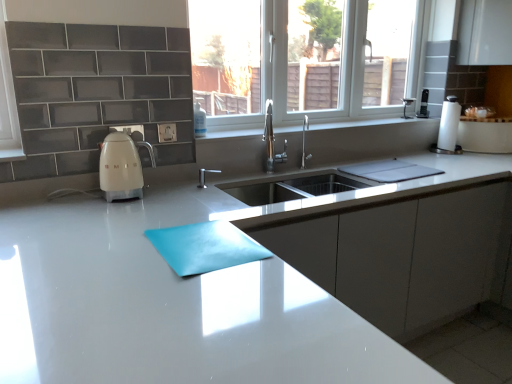
You are a GUI agent. You are given a task and a screenshot of the screen. Output one action in this format:
    pyautogui.click(x=<x>, y=<y>)
    Task: Click on the vacant region above white glossy countertop at center (from a real-world perspective)
    This screenshot has height=384, width=512.
    Given the screenshot: What is the action you would take?
    pyautogui.click(x=125, y=260)